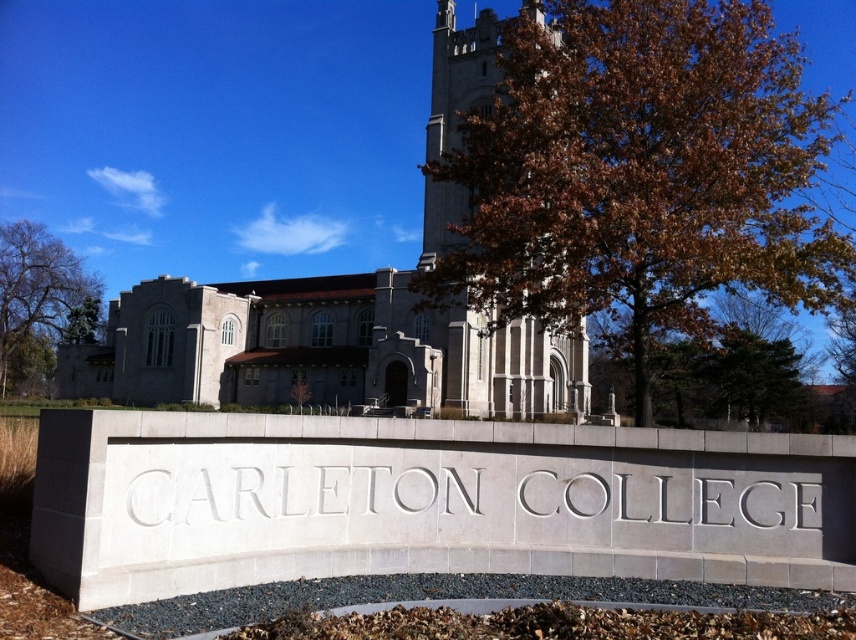
Can you confirm if brown leafy tree at upper center is smaller than brown leafy tree at left?

No.

Is brown leafy tree at upper center wider than brown leafy tree at left?

Yes, brown leafy tree at upper center is wider than brown leafy tree at left.

Between point (488, 145) and point (40, 236), which one is positioned behind?

Point (40, 236)

Where is `brown leafy tree at upper center`? This screenshot has height=640, width=856. brown leafy tree at upper center is located at coordinates (635, 172).

Does point (557, 380) come in front of point (0, 362)?

Yes, it is in front of point (0, 362).

Is gray stone tower at center wider than brown leafy tree at left?

No.

The width and height of the screenshot is (856, 640). In order to click on gray stone tower at center in this screenshot , I will do `click(512, 365)`.

Is brown leafy tree at upper center shorter than gray stone church at center?

Incorrect, brown leafy tree at upper center's height does not fall short of gray stone church at center's.

This screenshot has width=856, height=640. I want to click on brown leafy tree at upper center, so tap(635, 172).

Where is `brown leafy tree at upper center`? brown leafy tree at upper center is located at coordinates (635, 172).